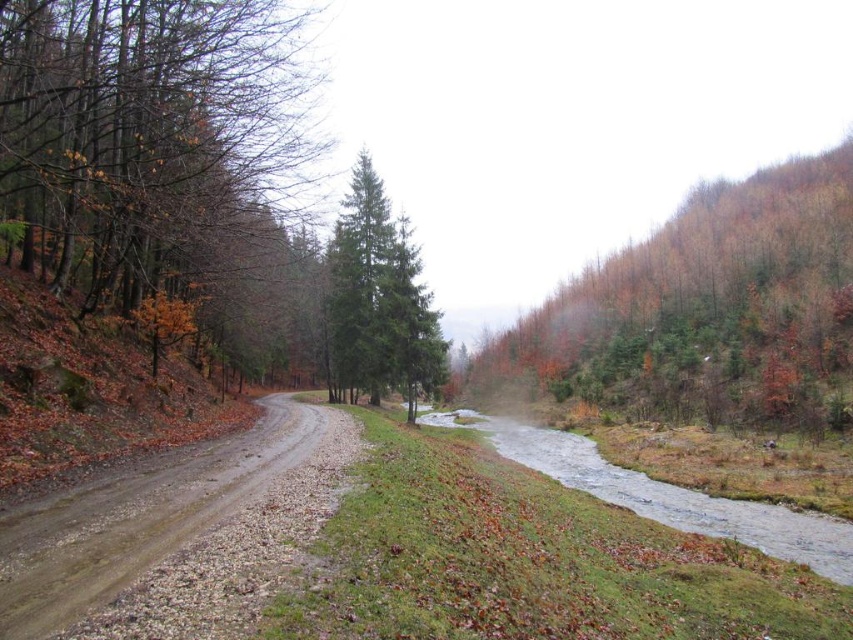
In the scene shown: You are hiking along the dirt road and want to take a photo of both the brown matte tree at left and the green matte tree at center. Which tree should you focus on first to ensure both are in the frame?

You should focus on the brown matte tree at left first since it is closer to you than the green matte tree at center, allowing both to be captured in the frame.

You are a hiker walking along the dirt road in the forest. You notice a brown matte tree at left and a green matte tree at center. Which tree is closer to you from your perspective on the road?

The brown matte tree at left is positioned over the green matte tree at center, meaning it is closer to you along the road.